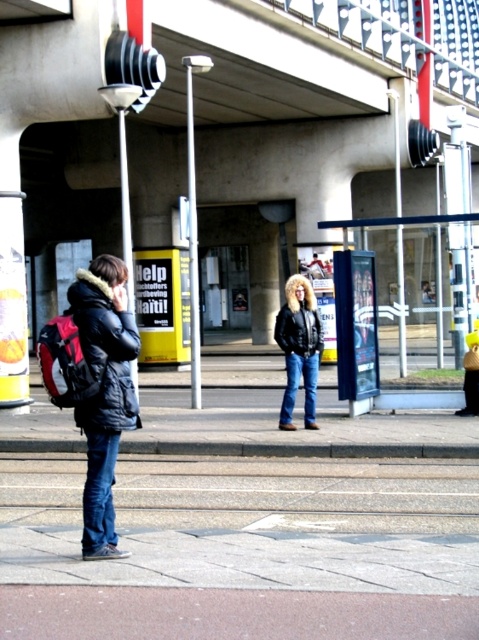
You are standing on the sidewalk in the urban street scene under the bridge. You see two points marked in the image. Which point is closer to you, point (465,321) or point (125,184)?

Point (465,321) is closer to the viewer than point (125,184).

You are a pedestrian standing on the sidewalk in the scene. You need to locate the metallic pole at center and the white plastic pole at upper center. Which pole is closer to your left side?

The metallic pole at center is to the left of the white plastic pole at upper center, so the metallic pole at center is closer to your left side.